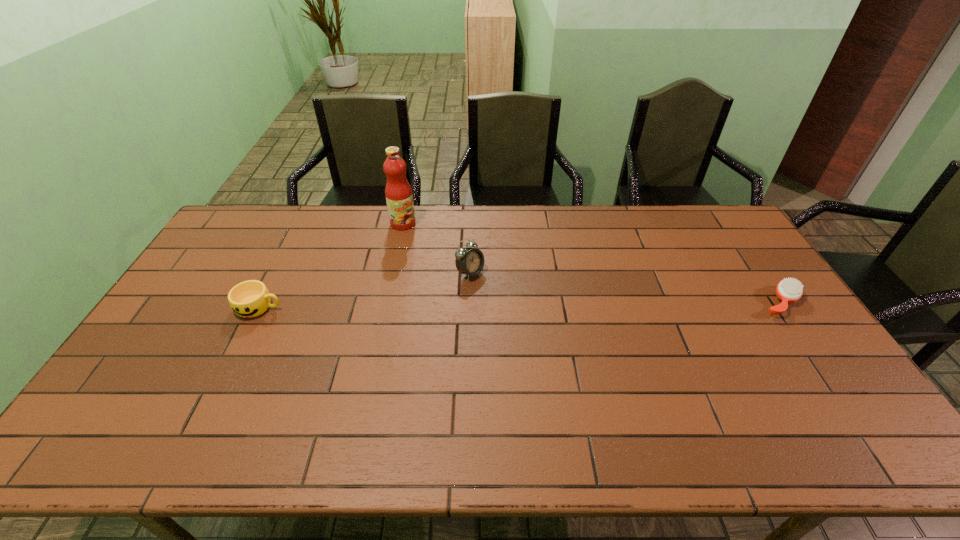
Locate an element on the screen. This screenshot has width=960, height=540. vacant spot on the desktop that is between the cup and the shortest object and is positioned on the front label of the tallest object is located at coordinates (482, 305).

Find the location of a particular element. The width and height of the screenshot is (960, 540). vacant space on the desktop that is between the third tallest object and the hairbrush and is positioned on the face of the third object from left to right is located at coordinates (523, 305).